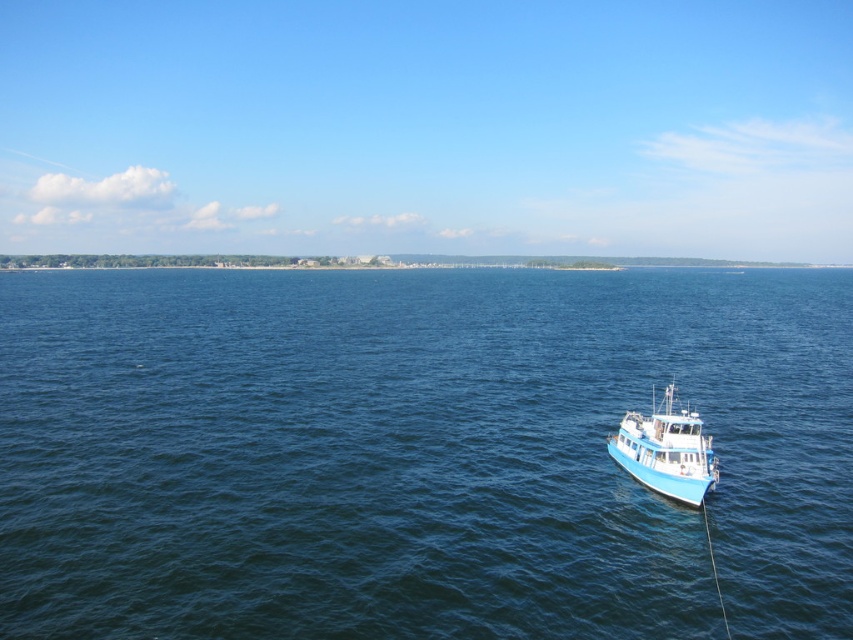
What do you see at coordinates (416, 452) in the screenshot? This screenshot has height=640, width=853. I see `blue water at lower right` at bounding box center [416, 452].

Who is more distant from viewer, (62, 595) or (624, 422)?

The point (624, 422) is more distant.

This screenshot has width=853, height=640. I want to click on blue water at lower right, so click(416, 452).